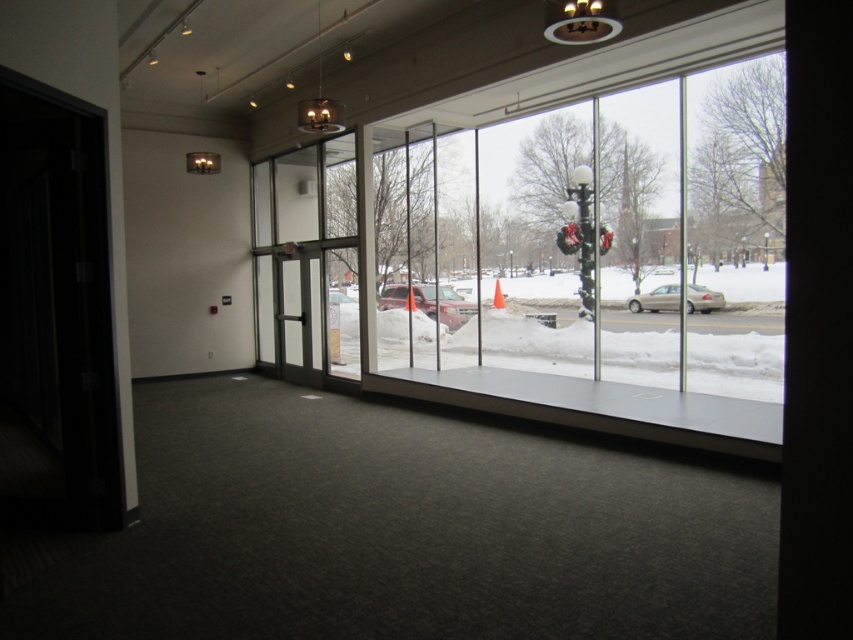
You are standing inside the building and looking through the large glass windows. You see two vehicles outside at the center of the snowy scene. Which vehicle is positioned to the left when viewed from the outside? The options are the matte red suv at center and the satin beige sedan at center.

The matte red suv at center is positioned to the left of the satin beige sedan at center when viewed from the outside.

You are standing inside the building looking out the window. There are two points marked on the glass window at coordinates point (648, 173) and point (680, 298). Which point is closer to you as you face the window?

Point (648, 173) is closer to you because it is in front of point (680, 298) on the window.